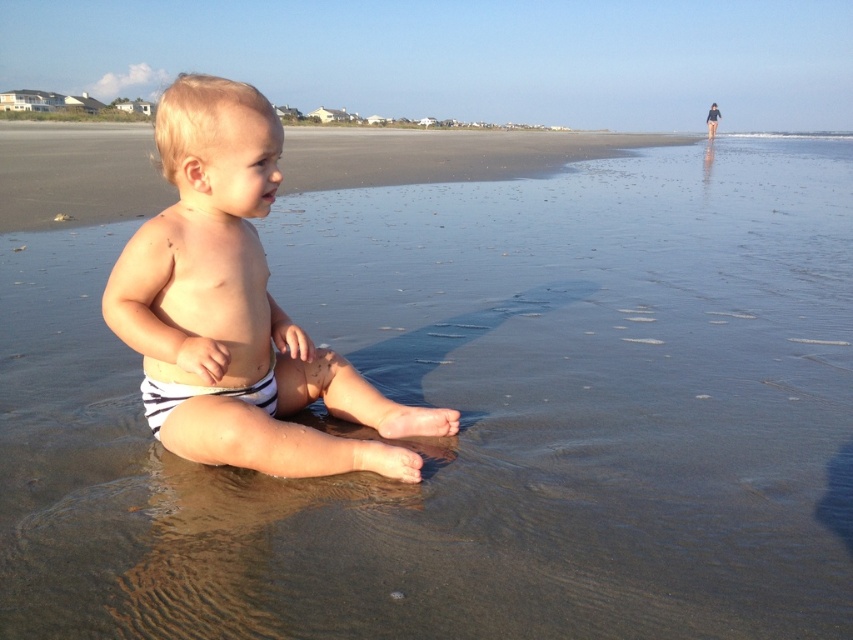
You are a lifeguard on duty and notice two diapers on the beach. The striped fabric diaper at center and the white striped diaper at center. Which one is bigger?

The striped fabric diaper at center has a larger size compared to the white striped diaper at center, so the striped fabric diaper at center is bigger.

You are a lifeguard on duty and need to place two diapers for a baby. The striped fabric diaper at center and the white striped diaper at center must be placed in such a way that they are not too close to each other. According to the scene description, what is the minimum distance you should keep between them?

The minimum distance between the striped fabric diaper at center and the white striped diaper at center should be at least 16.80 centimeters, as they are currently 16.80 centimeters apart in the scene.

You are standing at the edge of the beach looking towards the water. There are two points marked on the sand in front of you. The first point is at coordinates point [194,77] and the second is at point [148,404]. Which point is closer to you?

Point [194,77] is closer to the viewer than point [148,404].